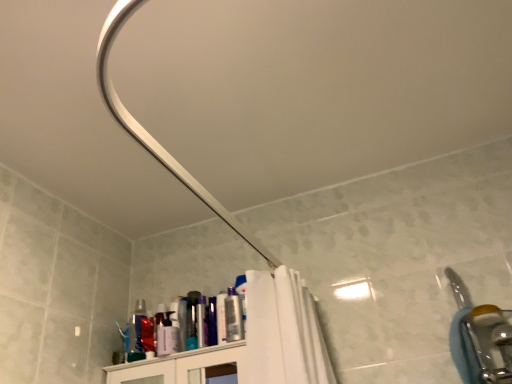
Image resolution: width=512 pixels, height=384 pixels. In order to click on silver metallic faucet at right in this screenshot , I will do `click(479, 338)`.

Describe the element at coordinates (202, 323) in the screenshot. Image resolution: width=512 pixels, height=384 pixels. I see `metallic silver can at upper center, the 2th toiletry in the right-to-left sequence` at that location.

Find the location of a particular element. The image size is (512, 384). silver metallic faucet at right is located at coordinates (479, 338).

Is metallic silver can at upper center, the 2th toiletry in the right-to-left sequence, wider than silver metallic faucet at right?

No, metallic silver can at upper center, the 2th toiletry in the right-to-left sequence, is not wider than silver metallic faucet at right.

From the picture: Is the position of metallic silver can at upper center, the 2th toiletry in the right-to-left sequence, more distant than that of silver metallic faucet at right?

Yes.

Consider the image. Who is bigger, metallic silver can at upper center, the 1th toiletry when ordered from left to right, or silver metallic faucet at right?

Bigger between the two is silver metallic faucet at right.

Between metallic silver can at upper center, the 1th toiletry when ordered from left to right, and silver metallic faucet at right, which one has more height?

silver metallic faucet at right is taller.

From the image's perspective, is metallic silver can at upper center, the 2th toiletry in the right-to-left sequence, located above matte plastic can at upper center, marked as the first toiletry in a right-to-left arrangement?

No.

From a real-world perspective, is metallic silver can at upper center, the 1th toiletry when ordered from left to right, positioned above or below matte plastic can at upper center, positioned as the second toiletry in left-to-right order?

metallic silver can at upper center, the 1th toiletry when ordered from left to right, is above matte plastic can at upper center, positioned as the second toiletry in left-to-right order.

Are metallic silver can at upper center, the 1th toiletry when ordered from left to right, and matte plastic can at upper center, positioned as the second toiletry in left-to-right order, making contact?

No, metallic silver can at upper center, the 1th toiletry when ordered from left to right, is not making contact with matte plastic can at upper center, positioned as the second toiletry in left-to-right order.

Does metallic silver can at upper center, the 1th toiletry when ordered from left to right, turn towards matte plastic can at upper center, marked as the first toiletry in a right-to-left arrangement?

No, metallic silver can at upper center, the 1th toiletry when ordered from left to right, is not facing towards matte plastic can at upper center, marked as the first toiletry in a right-to-left arrangement.

Who is shorter, matte plastic can at upper center, marked as the first toiletry in a right-to-left arrangement, or silver metallic faucet at right?

Standing shorter between the two is matte plastic can at upper center, marked as the first toiletry in a right-to-left arrangement.

Is silver metallic faucet at right inside matte plastic can at upper center, positioned as the second toiletry in left-to-right order?

Definitely not — silver metallic faucet at right is not inside matte plastic can at upper center, positioned as the second toiletry in left-to-right order.

From a real-world perspective, who is located lower, matte plastic can at upper center, marked as the first toiletry in a right-to-left arrangement, or silver metallic faucet at right?

silver metallic faucet at right, from a real-world perspective.

Measure the distance between matte plastic can at upper center, positioned as the second toiletry in left-to-right order, and silver metallic faucet at right.

26.28 inches.

Which object is positioned more to the left, matte plastic can at upper center, marked as the first toiletry in a right-to-left arrangement, or metallic silver can at upper center, the 1th toiletry when ordered from left to right?

From the viewer's perspective, metallic silver can at upper center, the 1th toiletry when ordered from left to right, appears more on the left side.

Who is taller, matte plastic can at upper center, positioned as the second toiletry in left-to-right order, or metallic silver can at upper center, the 2th toiletry in the right-to-left sequence?

Standing taller between the two is matte plastic can at upper center, positioned as the second toiletry in left-to-right order.

Looking at this image, from the image's perspective, which object appears higher, matte plastic can at upper center, marked as the first toiletry in a right-to-left arrangement, or metallic silver can at upper center, the 1th toiletry when ordered from left to right?

matte plastic can at upper center, marked as the first toiletry in a right-to-left arrangement, from the image's perspective.

How far apart are matte plastic can at upper center, positioned as the second toiletry in left-to-right order, and metallic silver can at upper center, the 2th toiletry in the right-to-left sequence?

matte plastic can at upper center, positioned as the second toiletry in left-to-right order, and metallic silver can at upper center, the 2th toiletry in the right-to-left sequence, are 4.24 inches apart from each other.

Does silver metallic faucet at right have a lesser width compared to metallic silver can at upper center, the 2th toiletry in the right-to-left sequence?

In fact, silver metallic faucet at right might be wider than metallic silver can at upper center, the 2th toiletry in the right-to-left sequence.

From a real-world perspective, is silver metallic faucet at right positioned above or below metallic silver can at upper center, the 2th toiletry in the right-to-left sequence?

From a real-world perspective, silver metallic faucet at right is physically below metallic silver can at upper center, the 2th toiletry in the right-to-left sequence.

From the image's perspective, is silver metallic faucet at right beneath metallic silver can at upper center, the 2th toiletry in the right-to-left sequence?

No, from the image's perspective, silver metallic faucet at right is not beneath metallic silver can at upper center, the 2th toiletry in the right-to-left sequence.

From a real-world perspective, is silver metallic faucet at right on top of matte plastic can at upper center, marked as the first toiletry in a right-to-left arrangement?

No, from a real-world perspective, silver metallic faucet at right is not over matte plastic can at upper center, marked as the first toiletry in a right-to-left arrangement

Is silver metallic faucet at right wider than matte plastic can at upper center, positioned as the second toiletry in left-to-right order?

Correct, the width of silver metallic faucet at right exceeds that of matte plastic can at upper center, positioned as the second toiletry in left-to-right order.

Who is shorter, silver metallic faucet at right or matte plastic can at upper center, positioned as the second toiletry in left-to-right order?

With less height is matte plastic can at upper center, positioned as the second toiletry in left-to-right order.

The image size is (512, 384). In order to click on the 2nd toiletry behind when counting from the silver metallic faucet at right in this screenshot , I will do `click(202, 323)`.

At what (x,y) coordinates should I click in order to perform the action: click on toiletry on the right of metallic silver can at upper center, the 1th toiletry when ordered from left to right. Please return your answer as a coordinate pair (x, y). Looking at the image, I should click on (233, 316).

Which object lies nearer to the anchor point metallic silver can at upper center, the 2th toiletry in the right-to-left sequence, matte plastic can at upper center, marked as the first toiletry in a right-to-left arrangement, or silver metallic faucet at right?

Based on the image, matte plastic can at upper center, marked as the first toiletry in a right-to-left arrangement, appears to be nearer to metallic silver can at upper center, the 2th toiletry in the right-to-left sequence.

Based on their spatial positions, is metallic silver can at upper center, the 2th toiletry in the right-to-left sequence, or silver metallic faucet at right closer to matte plastic can at upper center, marked as the first toiletry in a right-to-left arrangement?

Among the two, metallic silver can at upper center, the 2th toiletry in the right-to-left sequence, is located nearer to matte plastic can at upper center, marked as the first toiletry in a right-to-left arrangement.

From the image, which object appears to be farther from silver metallic faucet at right, matte plastic can at upper center, positioned as the second toiletry in left-to-right order, or metallic silver can at upper center, the 1th toiletry when ordered from left to right?

metallic silver can at upper center, the 1th toiletry when ordered from left to right, is further to silver metallic faucet at right.

Which object lies further to the anchor point metallic silver can at upper center, the 1th toiletry when ordered from left to right, silver metallic faucet at right or matte plastic can at upper center, positioned as the second toiletry in left-to-right order?

silver metallic faucet at right.

Considering their positions, is metallic silver can at upper center, the 1th toiletry when ordered from left to right, positioned closer to silver metallic faucet at right than matte plastic can at upper center, marked as the first toiletry in a right-to-left arrangement?

Among the two, matte plastic can at upper center, marked as the first toiletry in a right-to-left arrangement, is located nearer to silver metallic faucet at right.

In the scene shown: Based on their spatial positions, is silver metallic faucet at right or metallic silver can at upper center, the 2th toiletry in the right-to-left sequence, closer to matte plastic can at upper center, marked as the first toiletry in a right-to-left arrangement?

Among the two, metallic silver can at upper center, the 2th toiletry in the right-to-left sequence, is located nearer to matte plastic can at upper center, marked as the first toiletry in a right-to-left arrangement.

The width and height of the screenshot is (512, 384). In order to click on toiletry between metallic silver can at upper center, the 1th toiletry when ordered from left to right, and silver metallic faucet at right in this screenshot , I will do `click(233, 316)`.